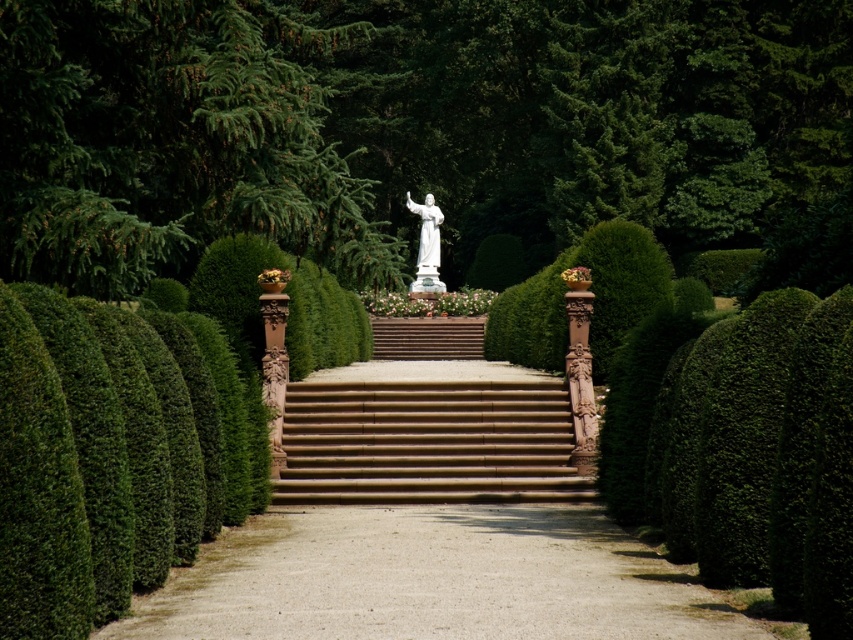
You are standing at the entrance of the garden and want to reach the white marble statue at center. Which direction should you move relative to the brown stone stairs at center?

You should move to the left of the brown stone stairs at center to reach the white marble statue at center since the brown stone stairs at center is positioned on the right side of the white marble statue at center.

You are standing at the entrance of the garden and see a point marked at coordinates (170, 141). Which object in the garden does this point correspond to?

The point at coordinates (170, 141) corresponds to the green leafy bush at upper center.